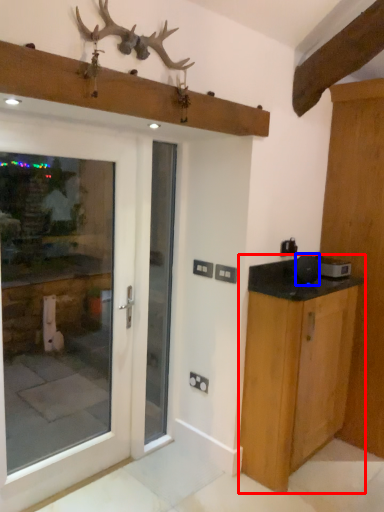
Question: Which object is further to the camera taking this photo, cabinetry (highlighted by a red box) or appliance (highlighted by a blue box)?

Choices:
 (A) cabinetry
 (B) appliance

Answer: (B)